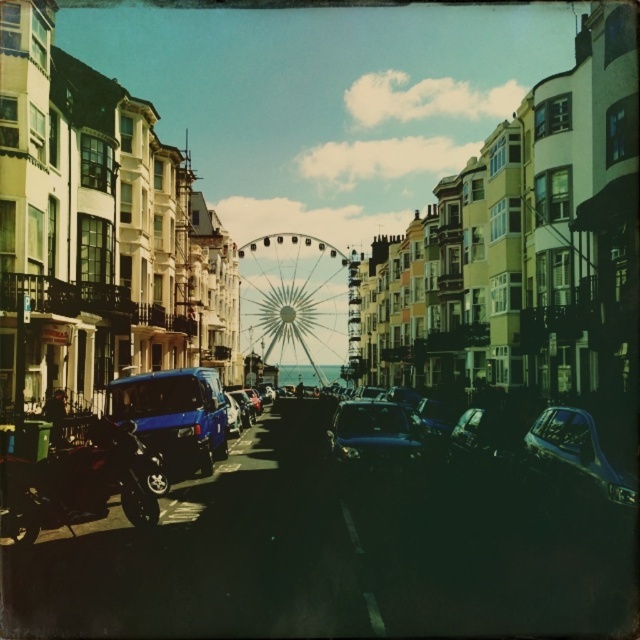
Which is in front, point (124, 436) or point (548, 444)?

Point (124, 436) is more forward.

Is point (44, 477) closer to camera compared to point (609, 470)?

No, it is not.

Is point (152, 525) closer to camera compared to point (564, 410)?

Yes, point (152, 525) is in front of point (564, 410).

Where is `shiny black motorcycle at lower left`? This screenshot has width=640, height=640. shiny black motorcycle at lower left is located at coordinates (84, 483).

Does point (88, 492) come in front of point (220, 433)?

That is True.

Between shiny black motorcycle at lower left and metallic blue van at center-left, which one appears on the left side from the viewer's perspective?

Positioned to the left is shiny black motorcycle at lower left.

The image size is (640, 640). In order to click on shiny black motorcycle at lower left in this screenshot , I will do `click(84, 483)`.

Is shiny black motorcycle at lower left bigger than shiny blue car at center?

Yes.

Between shiny black motorcycle at lower left and shiny blue car at center, which one has less height?

Standing shorter between the two is shiny blue car at center.

Who is more forward, (44, 502) or (365, 465)?

Point (44, 502) is in front.

Where is `shiny black motorcycle at lower left`? This screenshot has width=640, height=640. shiny black motorcycle at lower left is located at coordinates (84, 483).